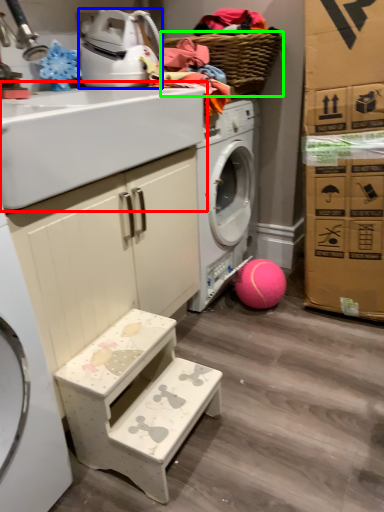
Question: Estimate the real-world distances between objects in this image. Which object is closer to sink (highlighted by a red box), appliance (highlighted by a blue box) or basket (highlighted by a green box)?

Choices:
 (A) appliance
 (B) basket

Answer: (A)